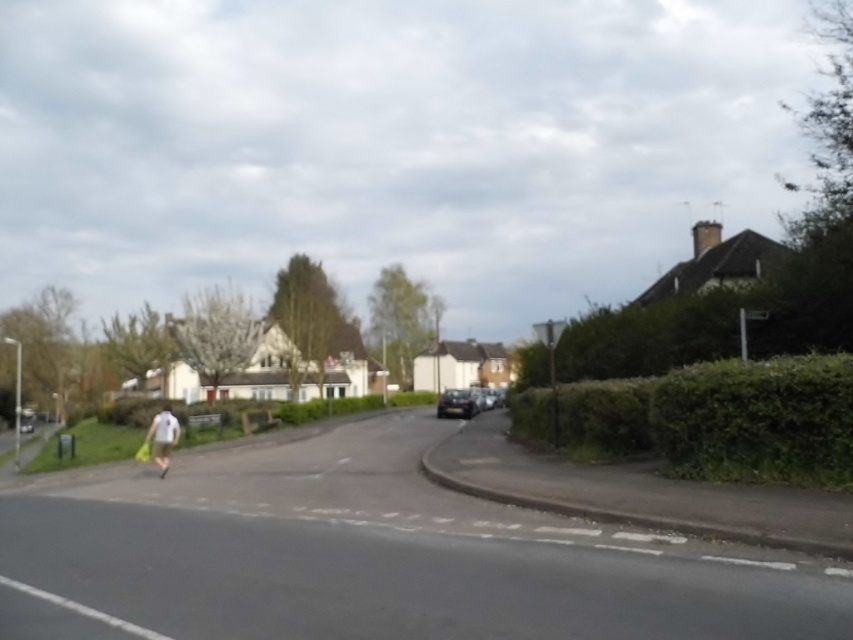
You are standing at the center of the road in the suburban street scene. You see a white fabric bag at lower left. Where is the white fabric bag relative to your position?

The white fabric bag at lower left is located at point 0.683 on the x axis and 0.191 on the y axis relative to the image frame.

You are a delivery person who needs to deliver a package to the shiny black car at center. You see the white fabric bag at lower left in the way. Can you go around it to reach the car?

The white fabric bag at lower left is positioned over the shiny black car at center, so you cannot go around it because the bag is directly covering the car.